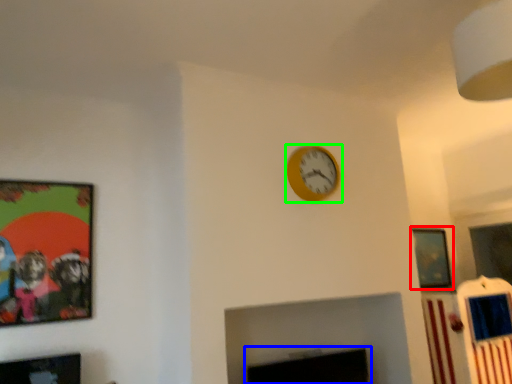
Question: Based on their relative distances, which object is nearer to picture frame (highlighted by a red box)? Choose from fireplace (highlighted by a blue box) and wall clock (highlighted by a green box).

Choices:
 (A) fireplace
 (B) wall clock

Answer: (A)